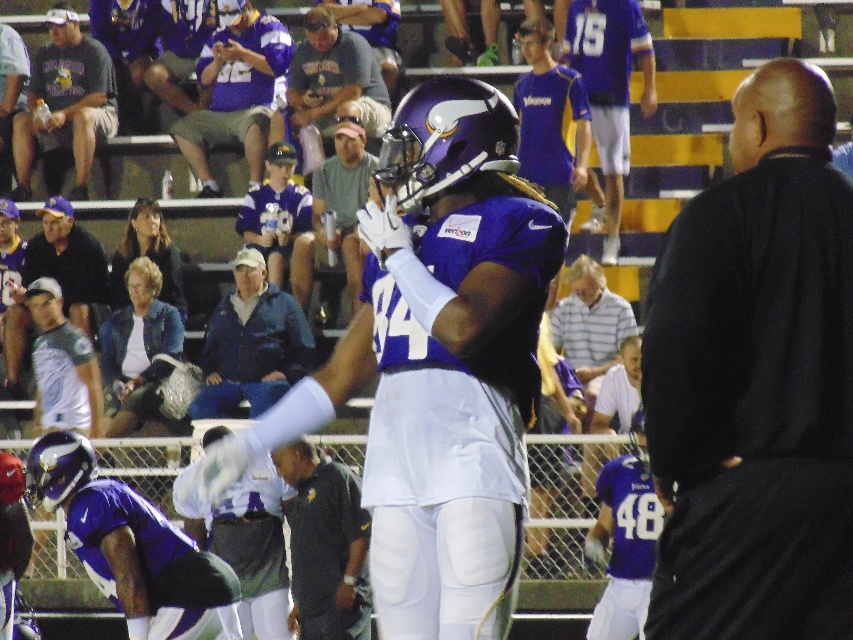
You are standing at the center of the field in the stadium where the Minnesota Vikings are playing. You want to kick a ball to the point marked at coordinates point (757, 406). If your maximum kicking distance is 8 meters, will you be able to reach that point?

The point (757, 406) is 8.40 meters away from the viewer. Since your maximum kicking distance is 8 meters, you will not be able to reach that point.